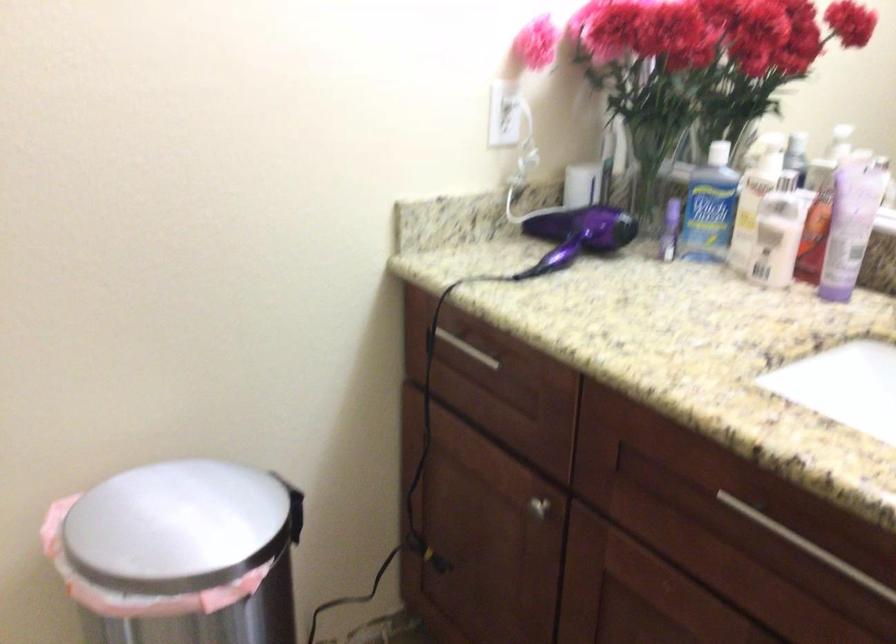
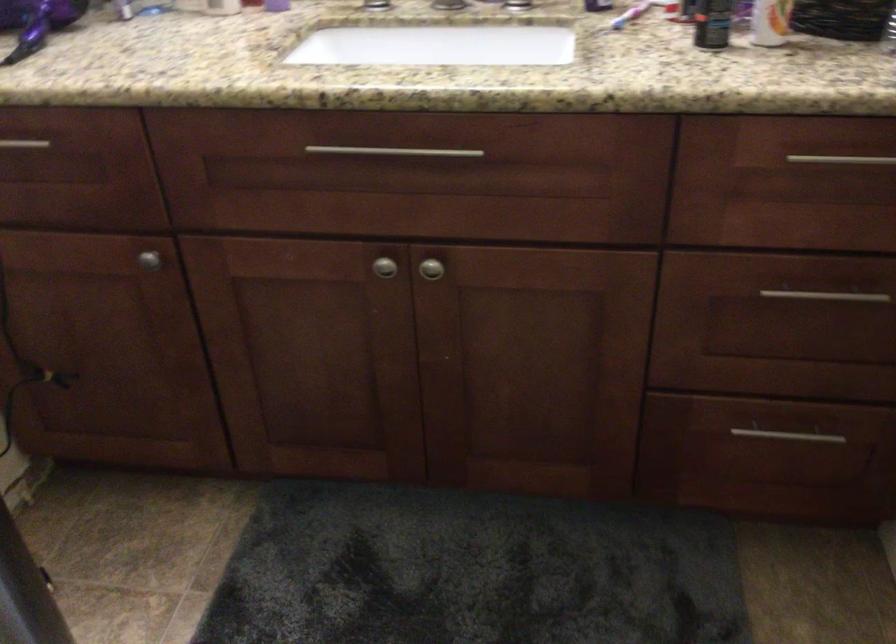
Find the pixel in the second image that matches the point at 823,553 in the first image.

(394, 152)